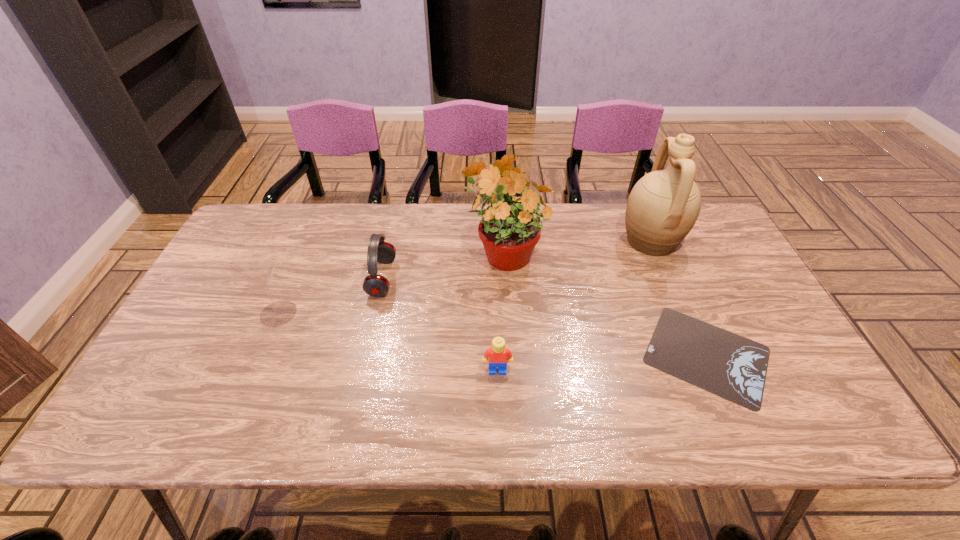
The height and width of the screenshot is (540, 960). I want to click on free space that is in between the fifth tallest object and the flute glass, so click(388, 342).

Choose which object is the third nearest neighbor to the flowerpot. Please provide its 2D coordinates. Your answer should be formatted as a tuple, i.e. [(x, y)], where the tuple contains the x and y coordinates of a point satisfying the conditions above.

[(663, 206)]

Point out which object is positioned as the second nearest to the mousepad. Please provide its 2D coordinates. Your answer should be formatted as a tuple, i.e. [(x, y)], where the tuple contains the x and y coordinates of a point satisfying the conditions above.

[(509, 231)]

Where is `free location that satisfies the following two spatial constraints: 1. on the front side of the flowerpot; 2. on the ear cups of the earphone`? free location that satisfies the following two spatial constraints: 1. on the front side of the flowerpot; 2. on the ear cups of the earphone is located at coordinates (505, 278).

Where is `free location that satisfies the following two spatial constraints: 1. on the ear cups of the earphone; 2. on the left side of the mousepad`? This screenshot has height=540, width=960. free location that satisfies the following two spatial constraints: 1. on the ear cups of the earphone; 2. on the left side of the mousepad is located at coordinates (365, 355).

At what (x,y) coordinates should I click in order to perform the action: click on free spot that satisfies the following two spatial constraints: 1. on the front side of the shortest object; 2. on the left side of the flute glass. Please return your answer as a coordinate pair (x, y). Image resolution: width=960 pixels, height=540 pixels. Looking at the image, I should click on 261,355.